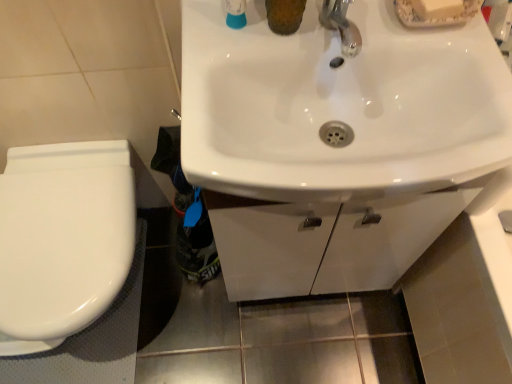
Where is `white glossy toilet at left`? The height and width of the screenshot is (384, 512). white glossy toilet at left is located at coordinates pos(63,239).

Describe the element at coordinates (63, 239) in the screenshot. This screenshot has width=512, height=384. I see `white glossy toilet at left` at that location.

What do you see at coordinates (339, 106) in the screenshot?
I see `white glossy sink at center` at bounding box center [339, 106].

Based on the photo, measure the distance between point [431,55] and camera.

Point [431,55] and camera are 27.44 inches apart.

The height and width of the screenshot is (384, 512). Identify the location of white glossy sink at center. (339, 106).

What are the coordinates of `white glossy toilet at left` in the screenshot? It's located at (63, 239).

Would you say white glossy sink at center is to the left or to the right of white glossy toilet at left in the picture?

Clearly, white glossy sink at center is on the right of white glossy toilet at left in the image.

Is the depth of white glossy sink at center greater than that of white glossy toilet at left?

No, white glossy sink at center is closer to the camera.

Which is more distant, (236, 156) or (79, 193)?

The point (79, 193) is farther from the camera.

From the image's perspective, does white glossy sink at center appear higher than white glossy toilet at left?

Yes, from the image's perspective, white glossy sink at center is over white glossy toilet at left.

From a real-world perspective, between white glossy sink at center and white glossy toilet at left, who is vertically lower?

In real-world perspective, white glossy toilet at left is lower.

Considering the sizes of objects white glossy sink at center and white glossy toilet at left in the image provided, who is wider, white glossy sink at center or white glossy toilet at left?

white glossy toilet at left is wider.

Considering the sizes of objects white glossy sink at center and white glossy toilet at left in the image provided, who is shorter, white glossy sink at center or white glossy toilet at left?

white glossy sink at center.

Considering the sizes of objects white glossy sink at center and white glossy toilet at left in the image provided, who is bigger, white glossy sink at center or white glossy toilet at left?

white glossy toilet at left is bigger.

Can white glossy toilet at left be found inside white glossy sink at center?

No.

Can you see white glossy sink at center touching white glossy toilet at left?

No, white glossy sink at center is not touching white glossy toilet at left.

Could you tell me if white glossy sink at center is facing white glossy toilet at left?

No.

Find the location of `toilet behind the white glossy sink at center`. toilet behind the white glossy sink at center is located at coordinates (63, 239).

Between white glossy toilet at left and white glossy sink at center, which one appears on the left side from the viewer's perspective?

white glossy toilet at left is more to the left.

Between white glossy toilet at left and white glossy sink at center, which one is positioned in front?

white glossy sink at center is closer to the camera.

Considering the positions of points (118, 144) and (301, 67), is point (118, 144) farther from camera compared to point (301, 67)?

That is True.

From the image's perspective, which one is positioned higher, white glossy toilet at left or white glossy sink at center?

From the image's view, white glossy sink at center is above.

From a real-world perspective, between white glossy toilet at left and white glossy sink at center, who is vertically higher?

white glossy sink at center, from a real-world perspective.

Does white glossy toilet at left have a lesser width compared to white glossy sink at center?

In fact, white glossy toilet at left might be wider than white glossy sink at center.

Is white glossy toilet at left taller than white glossy sink at center?

Correct, white glossy toilet at left is much taller as white glossy sink at center.

Consider the image. Considering the sizes of objects white glossy toilet at left and white glossy sink at center in the image provided, who is smaller, white glossy toilet at left or white glossy sink at center?

white glossy sink at center.

Is white glossy toilet at left positioned beyond the bounds of white glossy sink at center?

white glossy toilet at left lies outside white glossy sink at center's area.

Is white glossy toilet at left positioned far away from white glossy sink at center?

No, white glossy toilet at left is not far from white glossy sink at center.

Could you tell me if white glossy toilet at left is turned towards white glossy sink at center?

No, white glossy toilet at left is not turned towards white glossy sink at center.

How different are the orientations of white glossy toilet at left and white glossy sink at center in degrees?

They differ by 1.26 degrees in their facing directions.

Where is `sink that is above the white glossy toilet at left (from the image's perspective)`? The image size is (512, 384). sink that is above the white glossy toilet at left (from the image's perspective) is located at coordinates (339, 106).

Locate an element on the screen. sink above the white glossy toilet at left (from a real-world perspective) is located at coordinates (339, 106).

This screenshot has height=384, width=512. Identify the location of sink in front of the white glossy toilet at left. (339, 106).